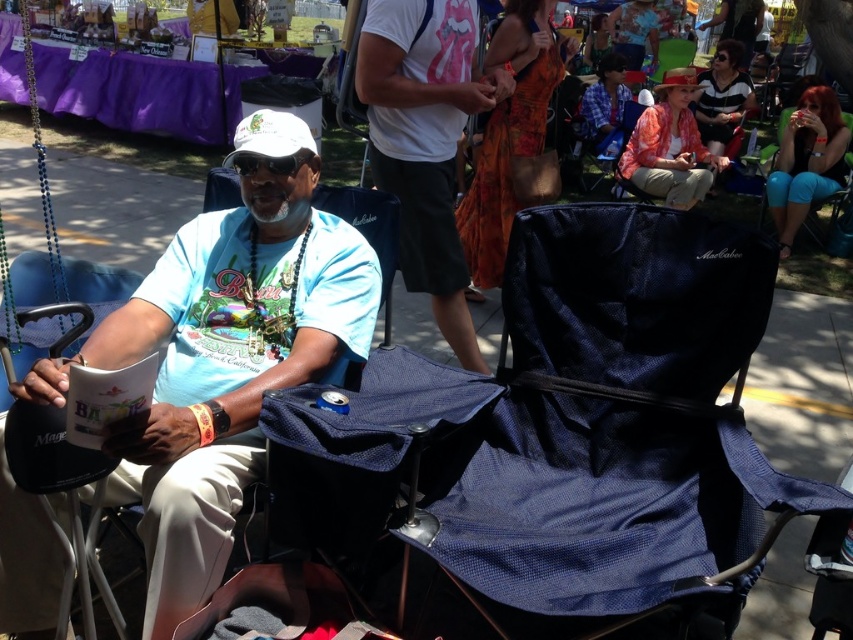
Can you confirm if matte blue t-shirt at center is wider than orange floral dress at upper center?

Yes.

Does matte blue t-shirt at center have a lesser width compared to orange floral dress at upper center?

In fact, matte blue t-shirt at center might be wider than orange floral dress at upper center.

The width and height of the screenshot is (853, 640). Identify the location of matte blue t-shirt at center. (229, 355).

Where is `matte blue t-shirt at center`? Image resolution: width=853 pixels, height=640 pixels. matte blue t-shirt at center is located at coordinates (229, 355).

Does striped fabric shirt at upper right have a lesser width compared to orange floral dress at upper center?

In fact, striped fabric shirt at upper right might be wider than orange floral dress at upper center.

Can you confirm if striped fabric shirt at upper right is positioned below orange floral dress at upper center?

Yes.

Describe the element at coordinates (722, 99) in the screenshot. This screenshot has width=853, height=640. I see `striped fabric shirt at upper right` at that location.

Locate an element on the screen. striped fabric shirt at upper right is located at coordinates (722, 99).

Can you confirm if white cotton t-shirt at center is positioned below matte orange blouse at upper right?

Yes.

Does point (363, 83) come behind point (659, 90)?

That is False.

Is point (432, 45) more distant than point (650, 164)?

No, (432, 45) is closer to viewer.

Find the location of a particular element. This screenshot has width=853, height=640. white cotton t-shirt at center is located at coordinates (425, 140).